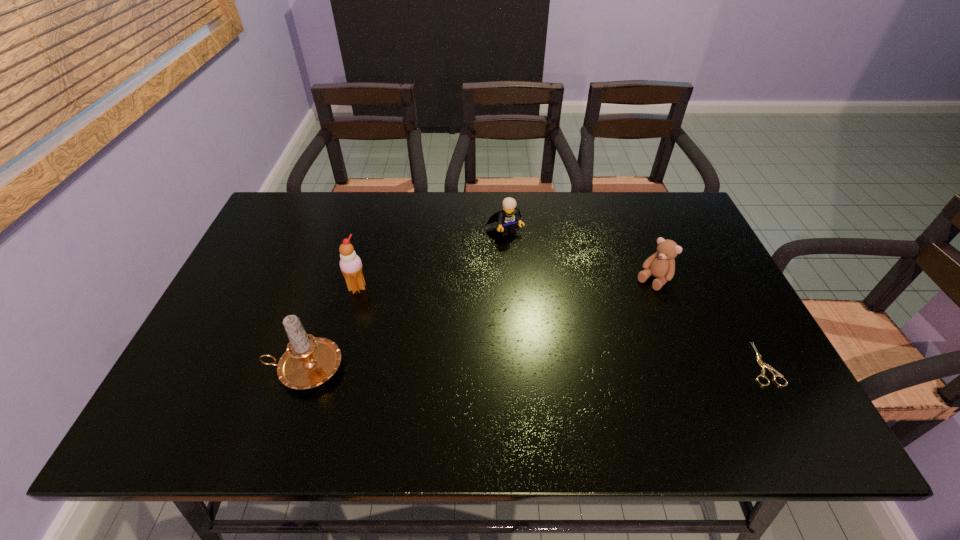
This screenshot has width=960, height=540. Identify the location of object that can be found as the second closest to the teddy bear. (507, 219).

This screenshot has height=540, width=960. In order to click on object that is the second closest to the candle in this screenshot , I will do `click(507, 219)`.

You are a GUI agent. You are given a task and a screenshot of the screen. Output one action in this format:
    pyautogui.click(x=<x>, y=<y>)
    Task: Click on the vacant space that satisfies the following two spatial constraints: 1. on the back side of the fourth object from left to right; 2. on the left side of the icecream
    This screenshot has height=540, width=960.
    Given the screenshot: What is the action you would take?
    pyautogui.click(x=359, y=280)

Find the location of a particular element. The image size is (960, 540). vacant point that satisfies the following two spatial constraints: 1. on the front side of the shortest object; 2. on the left side of the teddy bear is located at coordinates click(685, 364).